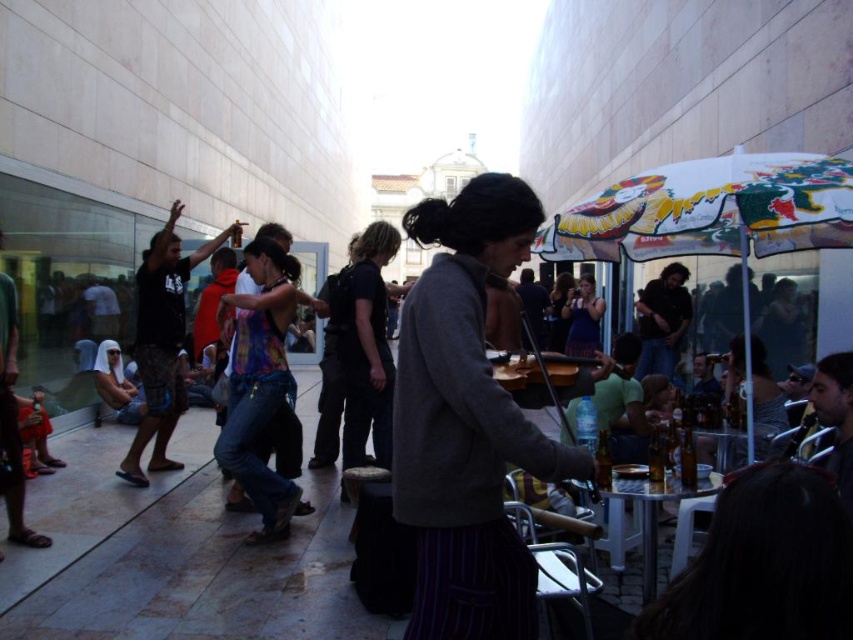
Between gray woolen sweater at center and printed fabric umbrella at center, which one is positioned lower?

gray woolen sweater at center is lower down.

Is point (424, 461) closer to viewer compared to point (828, 228)?

Yes, it is in front of point (828, 228).

This screenshot has height=640, width=853. Identify the location of gray woolen sweater at center. (467, 420).

Who is positioned more to the left, printed fabric umbrella at center or wooden violin at center?

Positioned to the left is wooden violin at center.

This screenshot has width=853, height=640. Find the location of `printed fabric umbrella at center`. printed fabric umbrella at center is located at coordinates (718, 211).

Does gray woolen sweater at center appear over wooden violin at center?

No.

Which is above, gray woolen sweater at center or wooden violin at center?

Positioned higher is wooden violin at center.

The height and width of the screenshot is (640, 853). Find the location of `gray woolen sweater at center`. gray woolen sweater at center is located at coordinates (467, 420).